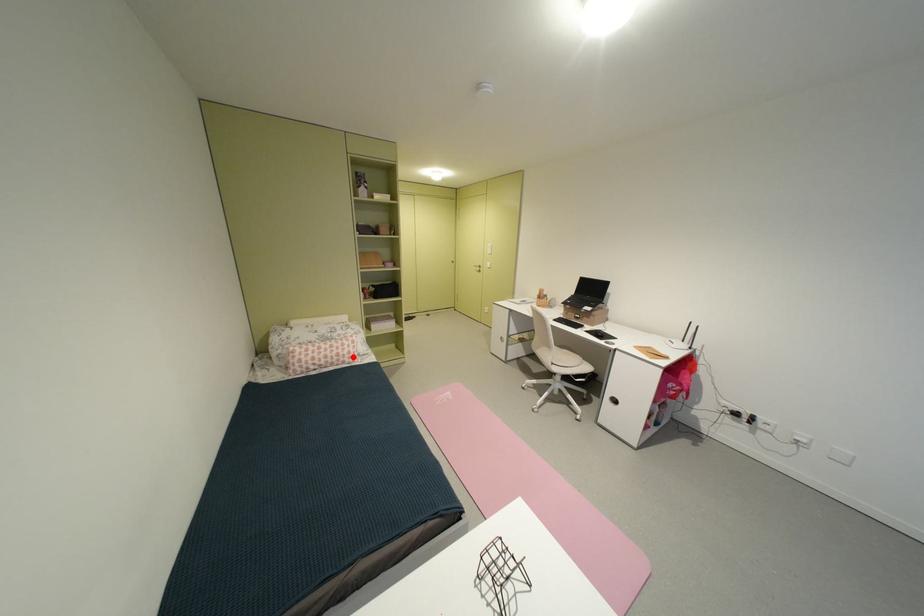
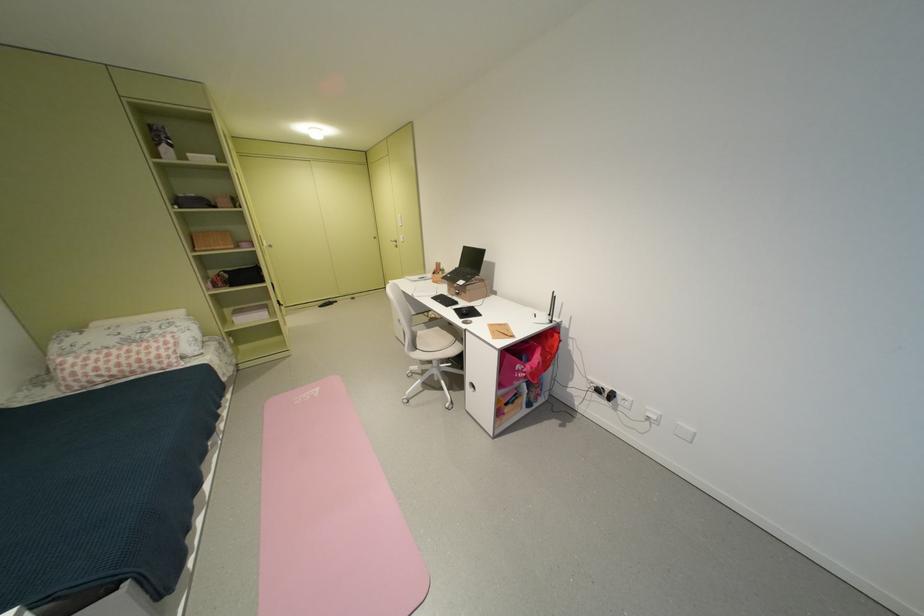
In the second image, find the point that corresponds to the highlighted location in the first image.

(159, 362)